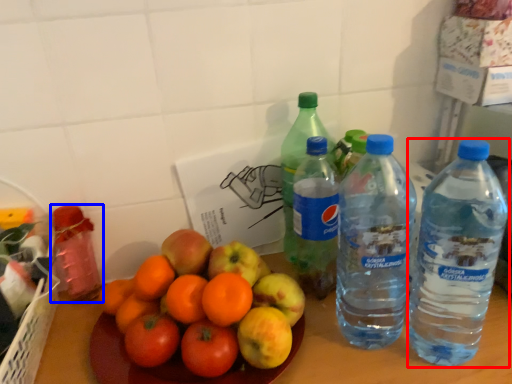
Question: Which object is further to the camera taking this photo, bottle (highlighted by a red box) or bottle (highlighted by a blue box)?

Choices:
 (A) bottle
 (B) bottle

Answer: (B)